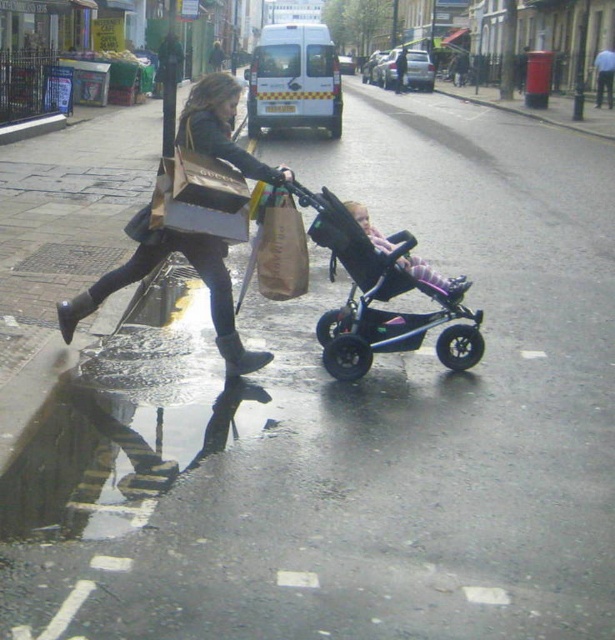
You are a delivery person trying to navigate through the street scene. The black plastic stroller at center is located at coordinates 0.464, 0.621. If you need to deliver a package to the address located at coordinates 0.5, 0.5, will you have to go around the stroller?

The black plastic stroller at center is located at coordinates (x=381, y=296). The delivery address is at coordinates (x=307, y=320). Since the stroller is very close to the delivery location, you will need to go around it to reach the destination.

You are a delivery person trying to place a package between the brown paper bag at center and the black rubber rain boot at lower left. Can you fit the package in the space between them?

The brown paper bag at center is closer to the viewer than the black rubber rain boot at lower left, so the space between them is not suitable for placing the package as they are not aligned along the same plane.